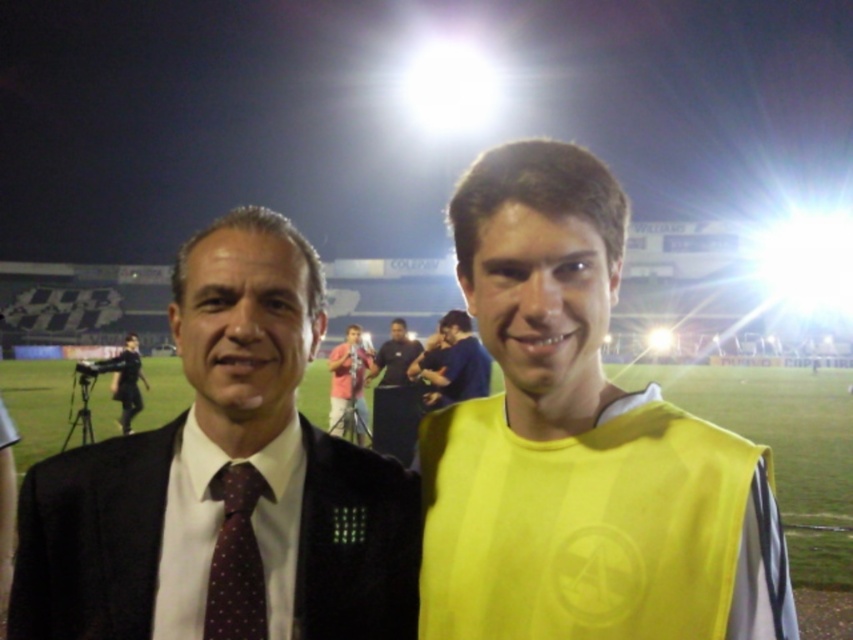
Which of these two, yellow fabric vest at right or black satin suit at center, stands taller?

Standing taller between the two is yellow fabric vest at right.

Is point (532, 260) farther from viewer compared to point (86, 541)?

No, (532, 260) is closer to viewer.

Is point (573, 625) in front of point (73, 509)?

Yes, it is in front of point (73, 509).

You are a GUI agent. You are given a task and a screenshot of the screen. Output one action in this format:
    pyautogui.click(x=<x>, y=<y>)
    Task: Click on the yellow fabric vest at right
    
    Given the screenshot: What is the action you would take?
    pyautogui.click(x=579, y=444)

Does pink fabric at center have a greater width compared to matte black shirt at center?

Yes, pink fabric at center is wider than matte black shirt at center.

What do you see at coordinates (347, 381) in the screenshot?
I see `pink fabric at center` at bounding box center [347, 381].

Where is `pink fabric at center`? The image size is (853, 640). pink fabric at center is located at coordinates (347, 381).

Can you confirm if yellow fabric vest at right is taller than yellow jersey at center?

Yes, yellow fabric vest at right is taller than yellow jersey at center.

Does point (724, 611) come farther from viewer compared to point (424, 364)?

No.

Is point (593, 346) farther from camera compared to point (436, 401)?

No, (593, 346) is in front of (436, 401).

The image size is (853, 640). I want to click on yellow fabric vest at right, so click(579, 444).